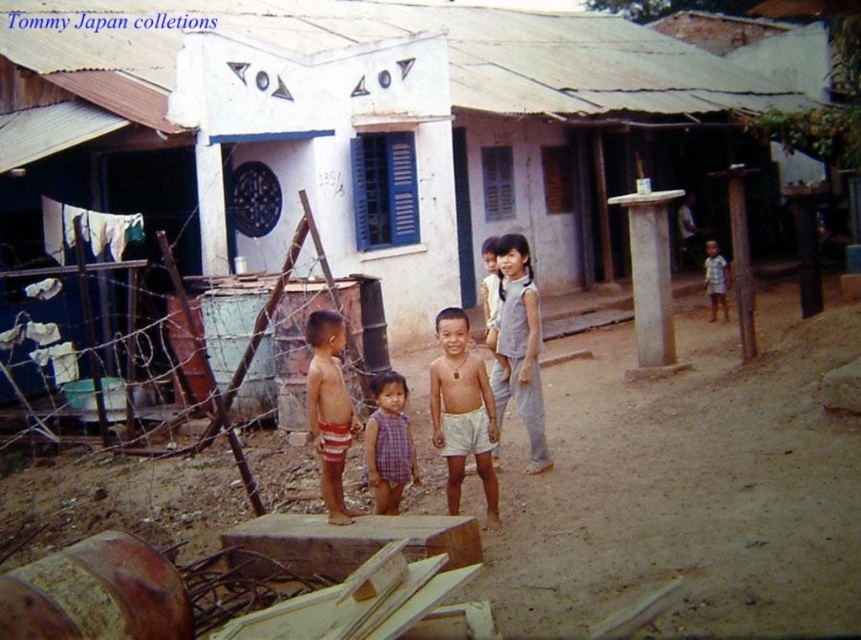
Consider the image. Does brown sandy ground at center have a greater height compared to white cotton shorts at center?

Incorrect, brown sandy ground at center's height is not larger of white cotton shorts at center's.

Does brown sandy ground at center have a lesser height compared to white cotton shorts at center?

Indeed, brown sandy ground at center has a lesser height compared to white cotton shorts at center.

Measure the distance between brown sandy ground at center and camera.

3.67 meters

Where is `brown sandy ground at center`? brown sandy ground at center is located at coordinates (689, 483).

Who is taller, white cotton shorts at center or striped cotton shirt at right?

With more height is white cotton shorts at center.

Who is positioned more to the left, white cotton shorts at center or striped cotton shirt at right?

Positioned to the left is white cotton shorts at center.

Who is more forward, (469, 364) or (719, 269)?

Point (469, 364)

Where is `white cotton shorts at center`? white cotton shorts at center is located at coordinates (462, 410).

Is white matte hut at center wider than gray cotton dress at center?

Yes.

Which is below, white matte hut at center or gray cotton dress at center?

gray cotton dress at center is below.

Between point (369, 51) and point (533, 285), which one is positioned behind?

The point (369, 51) is more distant.

Identify the location of white matte hut at center. This screenshot has width=861, height=640. (369, 125).